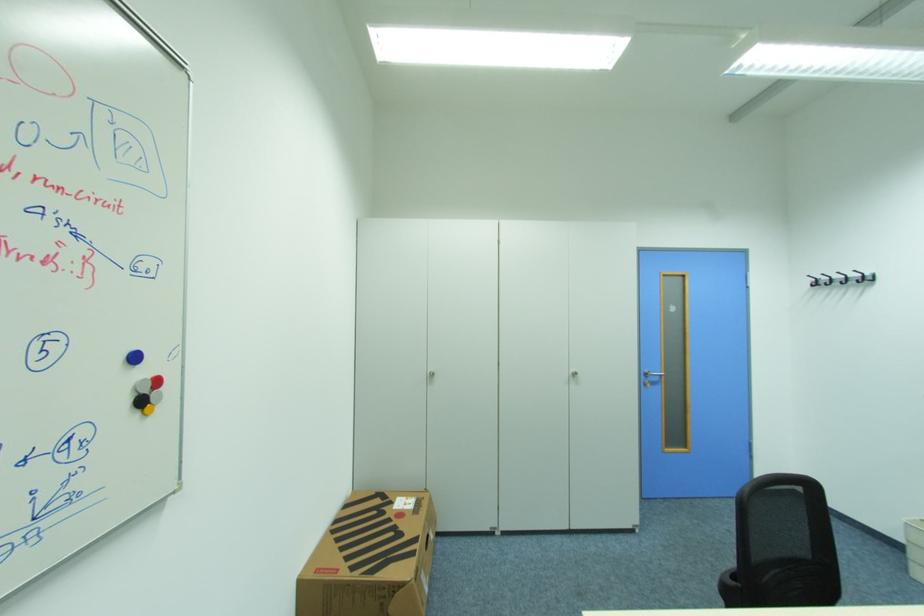
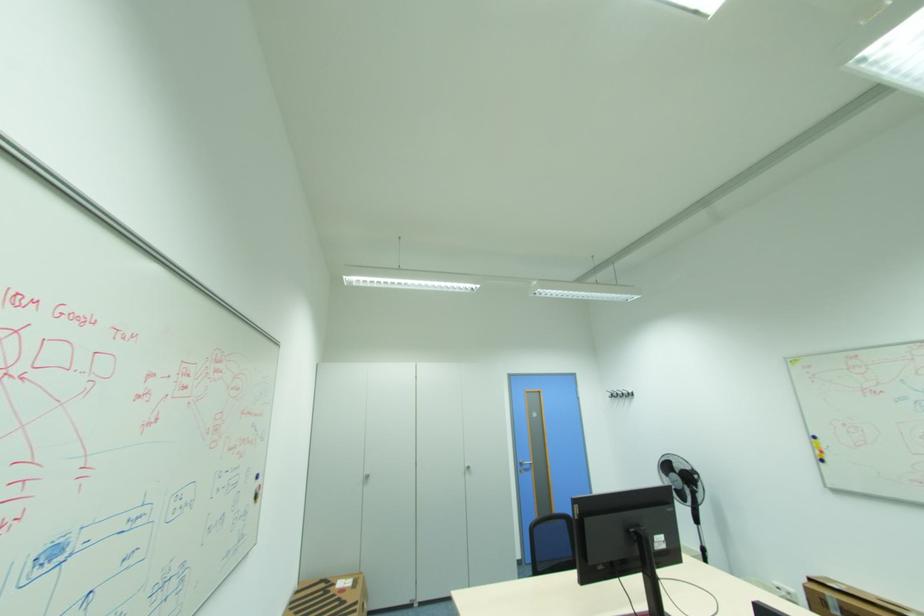
Find the pixel in the second image that matches point (815, 277) in the first image.

(613, 391)